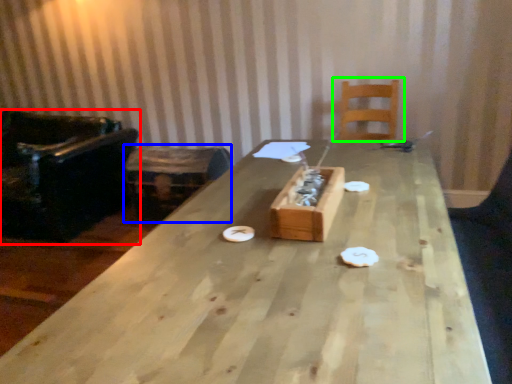
Question: Which is nearer to the chair (highlighted by a red box)? storage box (highlighted by a blue box) or chair (highlighted by a green box).

Choices:
 (A) storage box
 (B) chair

Answer: (A)